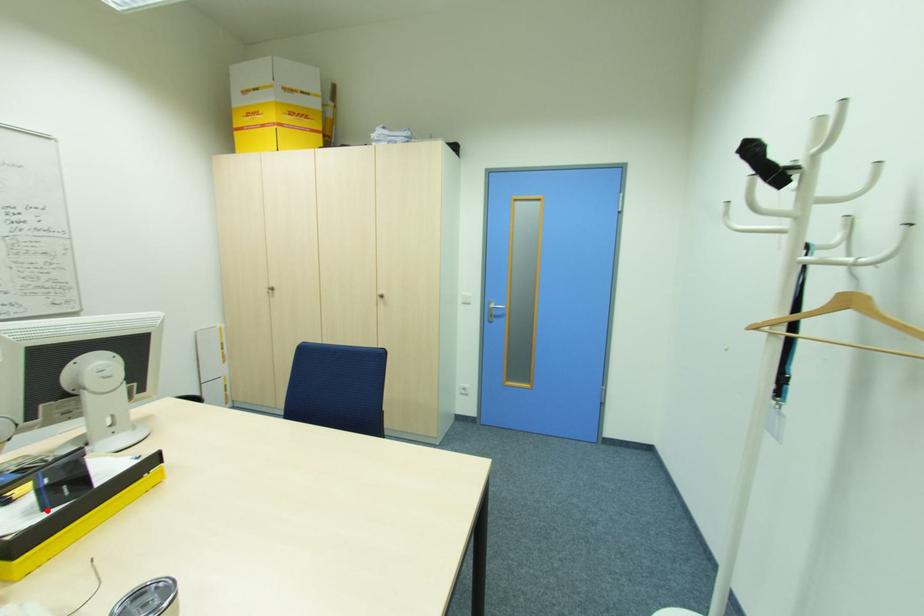
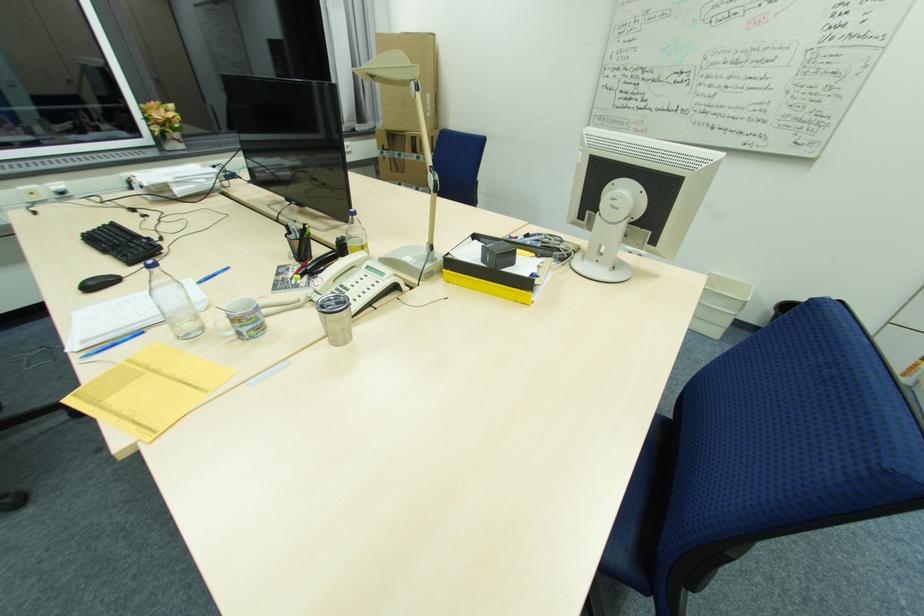
Question: I am providing you with two images of the same scene from different viewpoints. Image1 has a red point marked. In image2, the corresponding 3D location appears at what relative position? Reply with the corresponding letter.

Choices:
 (A) Closer
 (B) Farther

Answer: (A)